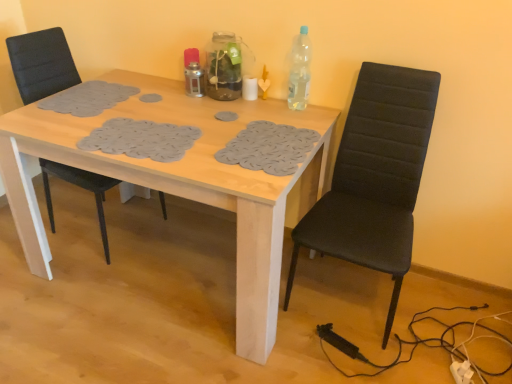
The height and width of the screenshot is (384, 512). Identify the location of free space to the left of black fabric chair at left, the 1th chair positioned from the left. (47, 220).